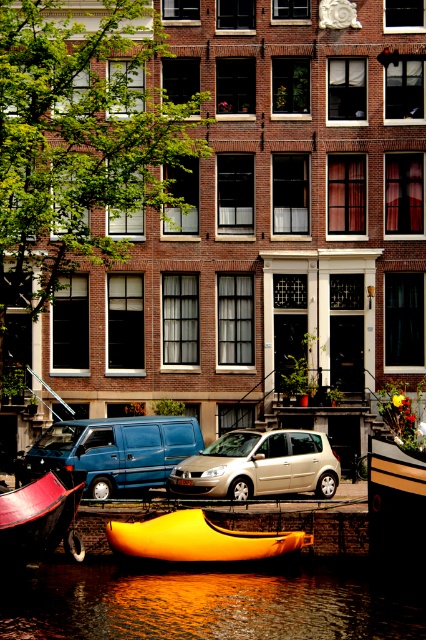
Does reflective water at lower center have a greater width compared to shiny yellow canoe at lower center?

Indeed, reflective water at lower center has a greater width compared to shiny yellow canoe at lower center.

Who is taller, reflective water at lower center or shiny yellow canoe at lower center?

Standing taller between the two is shiny yellow canoe at lower center.

This screenshot has width=426, height=640. What are the coordinates of `reflective water at lower center` in the screenshot? It's located at (201, 602).

Is point (154, 464) in front of point (307, 481)?

No, it is behind (307, 481).

Measure the distance between blue matte van at center and camera.

blue matte van at center and camera are 109.07 feet apart.

Locate an element on the screen. This screenshot has height=640, width=426. blue matte van at center is located at coordinates (115, 451).

Between point (5, 582) and point (77, 532), which one is positioned in front?

Positioned in front is point (5, 582).

Who is more distant from viewer, (126, 593) or (68, 516)?

Positioned behind is point (126, 593).

Measure the distance between reflective water at lower center and camera.

The distance of reflective water at lower center from camera is 74.93 feet.

Locate an element on the screen. reflective water at lower center is located at coordinates (201, 602).